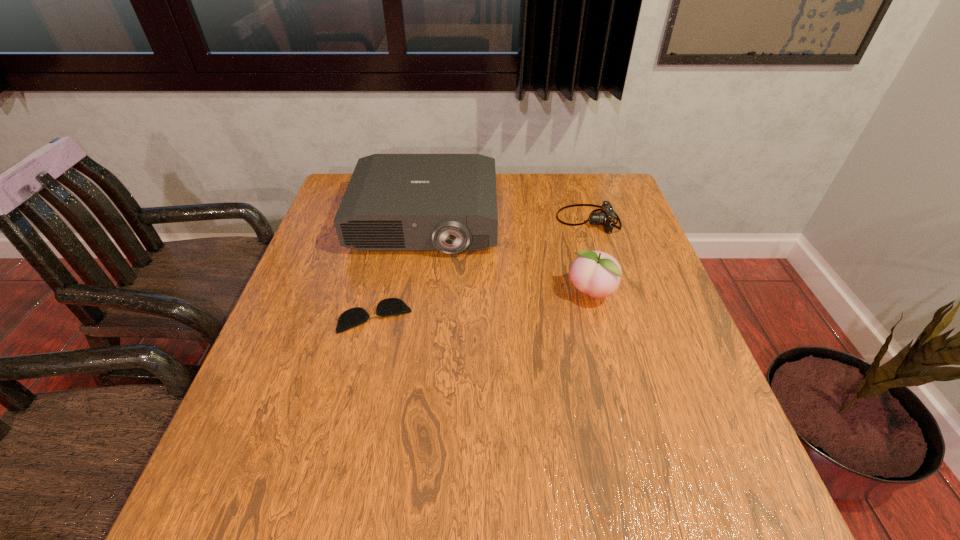
Where is `projector`? projector is located at coordinates (394, 202).

The image size is (960, 540). Find the location of `peach`. peach is located at coordinates (595, 273).

Image resolution: width=960 pixels, height=540 pixels. I want to click on the second shortest object, so click(x=606, y=217).

Locate an element on the screen. This screenshot has width=960, height=540. the shortest object is located at coordinates (350, 318).

This screenshot has width=960, height=540. Identify the location of free region located on the front-facing side of the projector. (400, 385).

Image resolution: width=960 pixels, height=540 pixels. I want to click on free space located on the front of the peach, so click(621, 413).

Where is `free space located 0.070m on the front-facing side of the camera`? This screenshot has height=540, width=960. free space located 0.070m on the front-facing side of the camera is located at coordinates (534, 220).

Image resolution: width=960 pixels, height=540 pixels. What are the coordinates of `free spot located on the front-facing side of the camera` in the screenshot? It's located at pyautogui.click(x=499, y=220).

Where is `free space located on the front-facing side of the camera`? This screenshot has width=960, height=540. free space located on the front-facing side of the camera is located at coordinates (503, 220).

Find the location of a particular element. Image resolution: width=960 pixels, height=540 pixels. free space located 0.120m on the right of the spectacles is located at coordinates (463, 316).